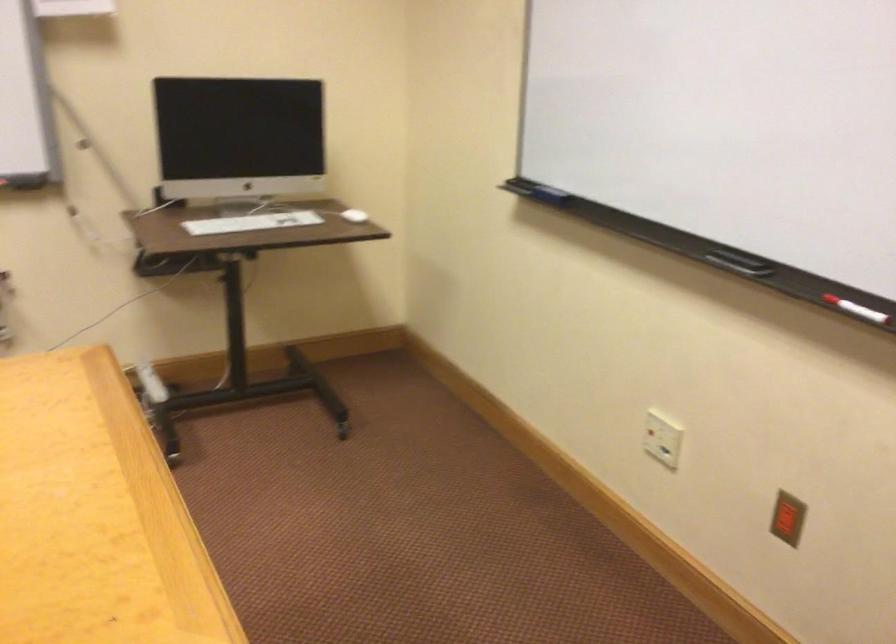
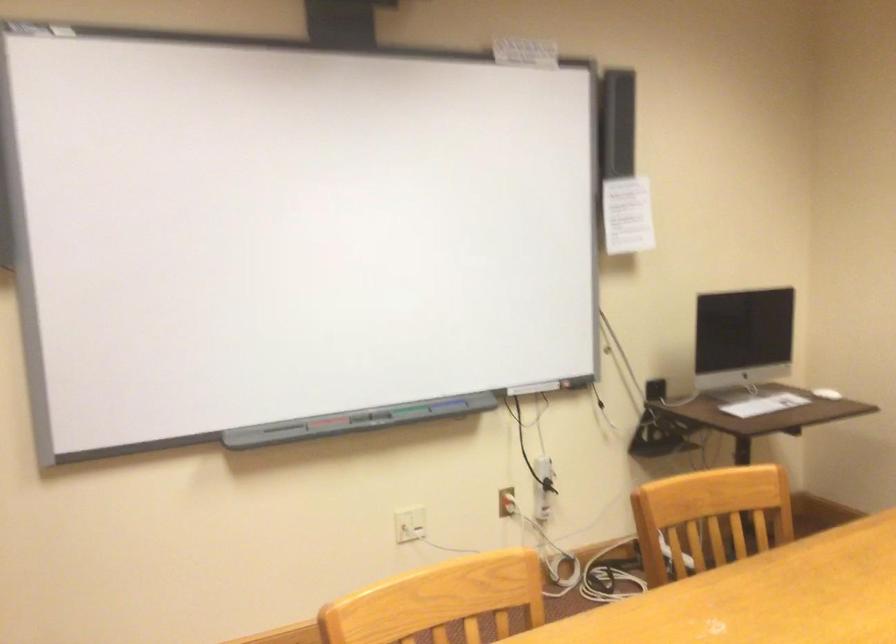
Question: Which direction would the cameraman need to move to produce the second image? Reply with the corresponding letter.

Choices:
 (A) Left
 (B) Right
 (C) Forward
 (D) Backward

Answer: (A)